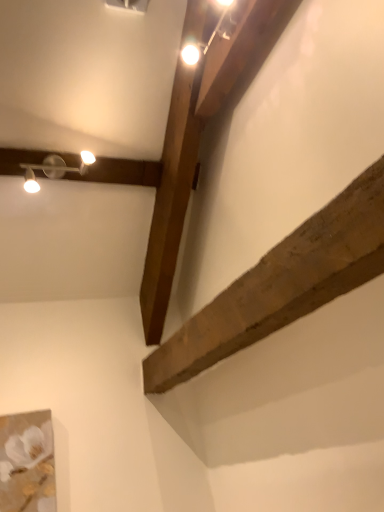
Measure the distance between matte white light fixture at upper center and camera.

The distance of matte white light fixture at upper center from camera is 1.33 meters.

What do you see at coordinates (202, 42) in the screenshot?
I see `matte white light fixture at upper center` at bounding box center [202, 42].

What is the approximate height of matte white light fixture at upper center?

It is 3.94 inches.

At what (x,y) coordinates should I click in order to perform the action: click on matte white light fixture at upper center. Please return your answer as a coordinate pair (x, y). Image resolution: width=384 pixels, height=512 pixels. Looking at the image, I should click on (202, 42).

The width and height of the screenshot is (384, 512). I want to click on matte white light fixture at upper center, so click(x=202, y=42).